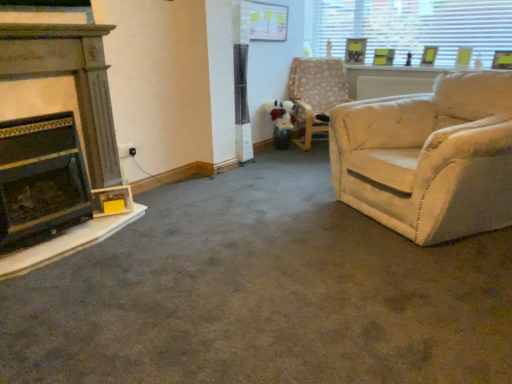
The width and height of the screenshot is (512, 384). I want to click on wooden picture frame at upper right, acting as the 3th picture frame starting from the right, so click(355, 50).

Describe the element at coordinates (355, 50) in the screenshot. Image resolution: width=512 pixels, height=384 pixels. I see `wooden picture frame at upper right, arranged as the 1th picture frame when viewed from the left` at that location.

Describe the element at coordinates (41, 180) in the screenshot. I see `black matte fireplace at left, the 1th fireplace when ordered from bottom to top` at that location.

Where is `wooden picture frame at upper right, arranged as the 2th picture frame when viewed from the left`? The image size is (512, 384). wooden picture frame at upper right, arranged as the 2th picture frame when viewed from the left is located at coordinates (383, 57).

Describe the element at coordinates (429, 55) in the screenshot. I see `matte yellow picture frame at upper right, which appears as the first picture frame when viewed from the right` at that location.

This screenshot has width=512, height=384. In order to click on transparent glass window at upper right in this screenshot , I will do `click(416, 27)`.

Image resolution: width=512 pixels, height=384 pixels. Identify the location of wooden fireplace at left, arranged as the second fireplace when ordered from the bottom. (54, 134).

Is wooden picture frame at upper right, acting as the 3th picture frame starting from the right, not close to black matte fireplace at left, the 1th fireplace when ordered from bottom to top?

wooden picture frame at upper right, acting as the 3th picture frame starting from the right, is far away from black matte fireplace at left, the 1th fireplace when ordered from bottom to top.

Which is in front, point (366, 41) or point (67, 174)?

The point (67, 174) is closer.

Can we say wooden picture frame at upper right, acting as the 3th picture frame starting from the right, lies outside black matte fireplace at left, the 1th fireplace when ordered from bottom to top?

Yes, wooden picture frame at upper right, acting as the 3th picture frame starting from the right, is not within black matte fireplace at left, the 1th fireplace when ordered from bottom to top.

From the picture: From the image's perspective, is wooden picture frame at upper right, arranged as the 2th picture frame when viewed from the left, beneath wooden picture frame at upper right, arranged as the 1th picture frame when viewed from the left?

Yes, from the image's perspective, wooden picture frame at upper right, arranged as the 2th picture frame when viewed from the left, is below wooden picture frame at upper right, arranged as the 1th picture frame when viewed from the left.

How much distance is there between wooden picture frame at upper right, the second picture frame positioned from the right, and wooden picture frame at upper right, acting as the 3th picture frame starting from the right?

wooden picture frame at upper right, the second picture frame positioned from the right, is 10.69 inches away from wooden picture frame at upper right, acting as the 3th picture frame starting from the right.

Find the location of a particular element. The image size is (512, 384). the 1st picture frame in front of the wooden picture frame at upper right, acting as the 3th picture frame starting from the right, counting from the anchor's position is located at coordinates (383, 57).

Could wooden picture frame at upper right, arranged as the 1th picture frame when viewed from the left, be considered to be inside wooden picture frame at upper right, the second picture frame positioned from the right?

No, wooden picture frame at upper right, the second picture frame positioned from the right, does not contain wooden picture frame at upper right, arranged as the 1th picture frame when viewed from the left.

Find the location of a particular element. This screenshot has width=512, height=384. the 1st fireplace below the wooden picture frame at upper right, arranged as the 1th picture frame when viewed from the left (from the image's perspective) is located at coordinates (54, 134).

Choose the correct answer: Is wooden fireplace at left, arranged as the second fireplace when ordered from the bottom, inside wooden picture frame at upper right, arranged as the 1th picture frame when viewed from the left, or outside it?

wooden fireplace at left, arranged as the second fireplace when ordered from the bottom, exists outside the volume of wooden picture frame at upper right, arranged as the 1th picture frame when viewed from the left.

Is wooden fireplace at left, arranged as the first fireplace when viewed from the top, in front of wooden picture frame at upper right, acting as the 3th picture frame starting from the right?

Yes, it is.

What's the angular difference between wooden fireplace at left, arranged as the second fireplace when ordered from the bottom, and wooden picture frame at upper right, arranged as the 1th picture frame when viewed from the left,'s facing directions?

They differ by 80.7 degrees in their facing directions.

Which is more to the left, beige fabric chair at upper right or black matte fireplace at left, positioned as the 2th fireplace in top-to-bottom order?

From the viewer's perspective, black matte fireplace at left, positioned as the 2th fireplace in top-to-bottom order, appears more on the left side.

I want to click on the 2nd fireplace in front of the beige fabric chair at upper right, counting from the anchor's position, so click(41, 180).

From a real-world perspective, is beige fabric chair at upper right physically located above or below black matte fireplace at left, positioned as the 2th fireplace in top-to-bottom order?

Clearly, from a real-world perspective, beige fabric chair at upper right is above black matte fireplace at left, positioned as the 2th fireplace in top-to-bottom order.

Is point (341, 88) closer or farther from the camera than point (87, 176)?

Point (341, 88).

In terms of width, does wooden picture frame at upper right, the second picture frame positioned from the right, look wider or thinner when compared to wooden fireplace at left, arranged as the first fireplace when viewed from the top?

In the image, wooden picture frame at upper right, the second picture frame positioned from the right, appears to be more narrow than wooden fireplace at left, arranged as the first fireplace when viewed from the top.

Find the location of a particular element. The width and height of the screenshot is (512, 384). the 1st fireplace to the left of the wooden picture frame at upper right, arranged as the 2th picture frame when viewed from the left, starting your count from the anchor is located at coordinates (54, 134).

Can you tell me how much wooden picture frame at upper right, arranged as the 2th picture frame when viewed from the left, and wooden fireplace at left, arranged as the first fireplace when viewed from the top, differ in facing direction?

The angular difference between wooden picture frame at upper right, arranged as the 2th picture frame when viewed from the left, and wooden fireplace at left, arranged as the first fireplace when viewed from the top, is 86.4 degrees.

Based on the photo, can you confirm if wooden picture frame at upper right, arranged as the 2th picture frame when viewed from the left, is bigger than wooden fireplace at left, arranged as the second fireplace when ordered from the bottom?

Actually, wooden picture frame at upper right, arranged as the 2th picture frame when viewed from the left, might be smaller than wooden fireplace at left, arranged as the second fireplace when ordered from the bottom.

Is point (431, 52) positioned behind point (91, 148)?

That is True.

In the scene shown: Are matte yellow picture frame at upper right, which appears as the first picture frame when viewed from the right, and wooden fireplace at left, arranged as the second fireplace when ordered from the bottom, making contact?

matte yellow picture frame at upper right, which appears as the first picture frame when viewed from the right, is not next to wooden fireplace at left, arranged as the second fireplace when ordered from the bottom, and they're not touching.

Consider the image. In the image, is matte yellow picture frame at upper right, the 3th picture frame positioned from the left, positioned in front of or behind wooden fireplace at left, arranged as the first fireplace when viewed from the top?

In the image, matte yellow picture frame at upper right, the 3th picture frame positioned from the left, appears behind wooden fireplace at left, arranged as the first fireplace when viewed from the top.

Is matte yellow picture frame at upper right, which appears as the first picture frame when viewed from the right, facing away from wooden fireplace at left, arranged as the first fireplace when viewed from the top?

matte yellow picture frame at upper right, which appears as the first picture frame when viewed from the right, is not turned away from wooden fireplace at left, arranged as the first fireplace when viewed from the top.

Is point (41, 193) less distant than point (320, 98)?

Yes, point (41, 193) is in front of point (320, 98).

This screenshot has width=512, height=384. Find the location of `fireplace above the beige fabric chair at upper right (from a real-world perspective)`. fireplace above the beige fabric chair at upper right (from a real-world perspective) is located at coordinates (54, 134).

Is wooden fireplace at left, arranged as the first fireplace when viewed from the top, to the right of beige fabric chair at upper right from the viewer's perspective?

In fact, wooden fireplace at left, arranged as the first fireplace when viewed from the top, is to the left of beige fabric chair at upper right.

At what (x,y) coordinates should I click in order to perform the action: click on the 3rd picture frame above the black matte fireplace at left, the 1th fireplace when ordered from bottom to top (from the image's perspective). Please return your answer as a coordinate pair (x, y). Looking at the image, I should click on (355, 50).

The image size is (512, 384). What are the coordinates of `picture frame behind the wooden picture frame at upper right, the second picture frame positioned from the right` in the screenshot? It's located at (355, 50).

Based on their spatial positions, is wooden picture frame at upper right, the second picture frame positioned from the right, or beige fabric chair at upper right closer to matte yellow picture frame at upper right, the 3th picture frame positioned from the left?

wooden picture frame at upper right, the second picture frame positioned from the right.

Which object lies nearer to the anchor point wooden fireplace at left, arranged as the first fireplace when viewed from the top, wooden picture frame at upper right, arranged as the 1th picture frame when viewed from the left, or beige fabric chair at upper right?

beige fabric chair at upper right.

Which object lies further to the anchor point black matte fireplace at left, the 1th fireplace when ordered from bottom to top, wooden picture frame at upper right, arranged as the 1th picture frame when viewed from the left, or wooden picture frame at upper right, the second picture frame positioned from the right?

Based on the image, wooden picture frame at upper right, arranged as the 1th picture frame when viewed from the left, appears to be further to black matte fireplace at left, the 1th fireplace when ordered from bottom to top.

From the image, which object appears to be nearer to wooden picture frame at upper right, arranged as the 1th picture frame when viewed from the left, wooden picture frame at upper right, arranged as the 2th picture frame when viewed from the left, or beige fabric chair at upper right?

wooden picture frame at upper right, arranged as the 2th picture frame when viewed from the left, is closer to wooden picture frame at upper right, arranged as the 1th picture frame when viewed from the left.

Estimate the real-world distances between objects in this image. Which object is further from matte yellow picture frame at upper right, which appears as the first picture frame when viewed from the right, wooden fireplace at left, arranged as the second fireplace when ordered from the bottom, or beige fabric chair at upper right?

wooden fireplace at left, arranged as the second fireplace when ordered from the bottom, is positioned further to the anchor matte yellow picture frame at upper right, which appears as the first picture frame when viewed from the right.

From the picture: Based on their spatial positions, is black matte fireplace at left, the 1th fireplace when ordered from bottom to top, or beige fabric chair at upper right closer to matte yellow picture frame at upper right, the 3th picture frame positioned from the left?

Based on the image, beige fabric chair at upper right appears to be nearer to matte yellow picture frame at upper right, the 3th picture frame positioned from the left.

Based on their spatial positions, is wooden fireplace at left, arranged as the first fireplace when viewed from the top, or wooden picture frame at upper right, arranged as the 1th picture frame when viewed from the left, further from wooden picture frame at upper right, arranged as the 2th picture frame when viewed from the left?

wooden fireplace at left, arranged as the first fireplace when viewed from the top, lies further to wooden picture frame at upper right, arranged as the 2th picture frame when viewed from the left, than the other object.

Considering their positions, is wooden fireplace at left, arranged as the second fireplace when ordered from the bottom, positioned further to transparent glass window at upper right than black matte fireplace at left, positioned as the 2th fireplace in top-to-bottom order?

Among the two, black matte fireplace at left, positioned as the 2th fireplace in top-to-bottom order, is located further to transparent glass window at upper right.

Locate an element on the screen. This screenshot has width=512, height=384. chair between wooden fireplace at left, arranged as the first fireplace when viewed from the top, and transparent glass window at upper right from left to right is located at coordinates (316, 93).

Identify the location of chair between black matte fireplace at left, the 1th fireplace when ordered from bottom to top, and matte yellow picture frame at upper right, which appears as the first picture frame when viewed from the right, from left to right. (316, 93).

You are a GUI agent. You are given a task and a screenshot of the screen. Output one action in this format:
    pyautogui.click(x=<x>, y=<y>)
    Task: Click on the window between wooden fireplace at left, arranged as the second fireplace when ordered from the bottom, and matte yellow picture frame at upper right, which appears as the first picture frame when viewed from the right, from left to right
    The height and width of the screenshot is (384, 512).
    Given the screenshot: What is the action you would take?
    pyautogui.click(x=416, y=27)

Where is `chair between black matte fireplace at left, positioned as the 2th fireplace in top-to-bottom order, and transparent glass window at upper right`? This screenshot has width=512, height=384. chair between black matte fireplace at left, positioned as the 2th fireplace in top-to-bottom order, and transparent glass window at upper right is located at coordinates (316, 93).